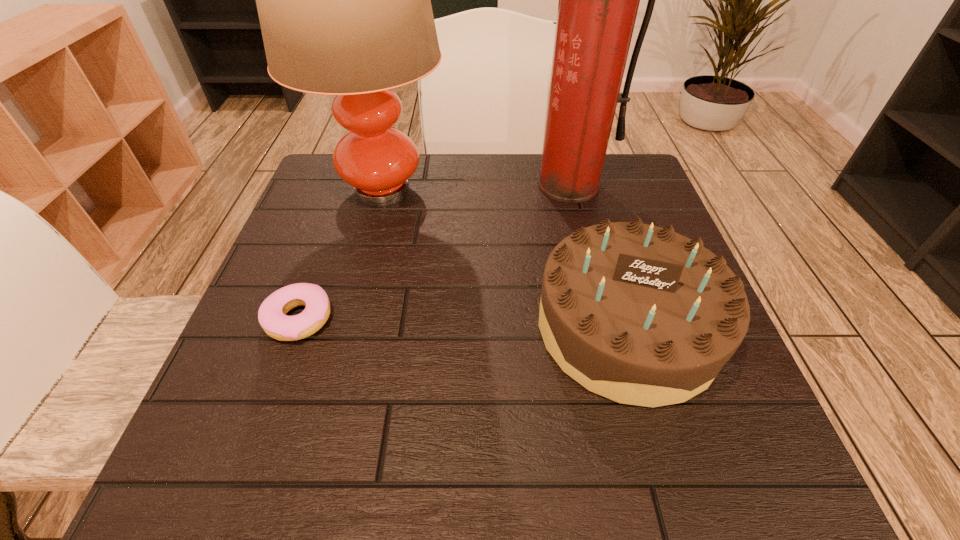
Image resolution: width=960 pixels, height=540 pixels. I want to click on vacant area that lies between the shortest object and the lamp, so click(340, 255).

Where is `empty location between the fire extinguisher and the shortest object`? The width and height of the screenshot is (960, 540). empty location between the fire extinguisher and the shortest object is located at coordinates (434, 252).

Identify the location of unoccupied position between the doughnut and the birthday cake. (463, 323).

Find the location of a particular element. vacant point located between the lamp and the fire extinguisher is located at coordinates (475, 188).

At what (x,y) coordinates should I click in order to perform the action: click on free space between the shortest object and the third tallest object. Please return your answer as a coordinate pair (x, y). Looking at the image, I should click on (463, 323).

Where is `free space between the birthday cake and the doughnut`? free space between the birthday cake and the doughnut is located at coordinates (463, 323).

The width and height of the screenshot is (960, 540). I want to click on free space between the fire extinguisher and the lamp, so click(x=475, y=188).

Image resolution: width=960 pixels, height=540 pixels. I want to click on vacant point located between the lamp and the fire extinguisher, so click(475, 188).

Image resolution: width=960 pixels, height=540 pixels. Find the location of `vacant area between the doughnut and the lamp`. vacant area between the doughnut and the lamp is located at coordinates (340, 255).

Identify the location of free spot between the doughnut and the fire extinguisher. (434, 252).